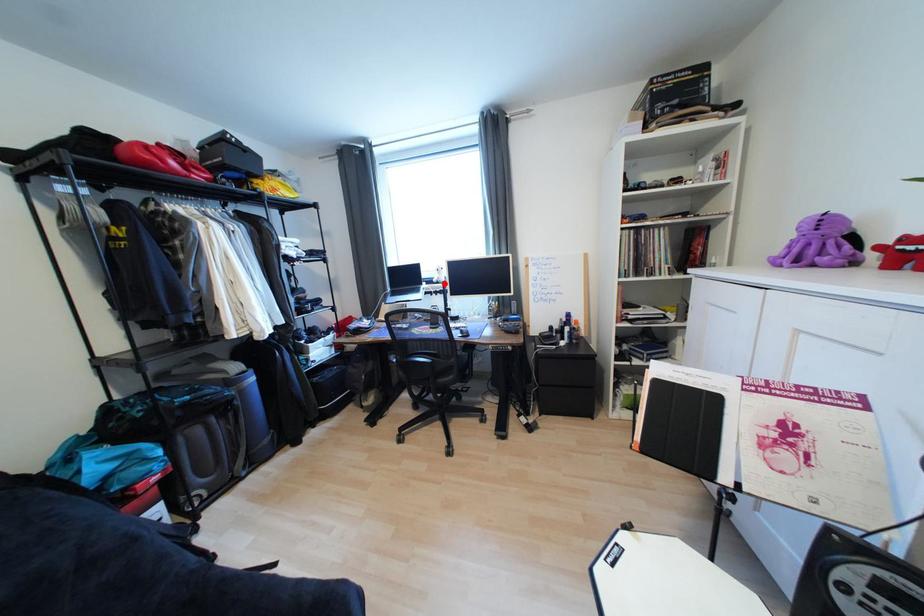
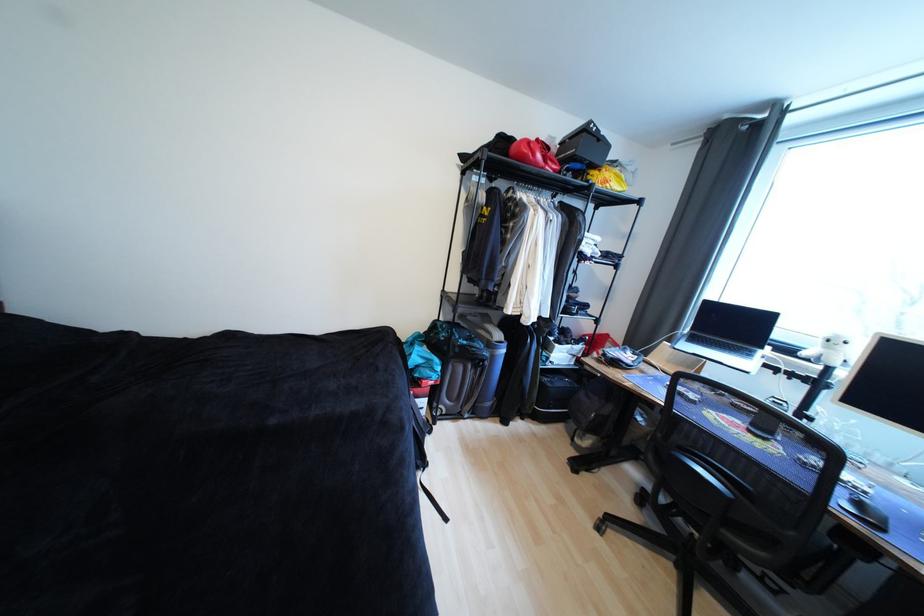
Question: I am providing you with two images of the same scene from different viewpoints. Image1 has a red point marked. In image2, the corresponding 3D location appears at what relative position? Reply with the corresponding letter.

Choices:
 (A) Closer
 (B) Farther

Answer: (B)